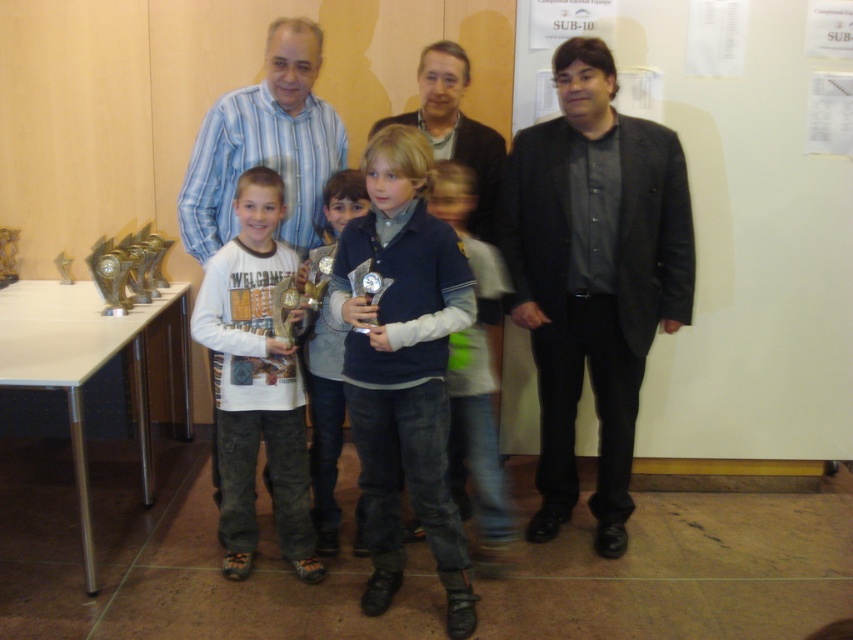
Question: Is dark blue denim jeans at center below denim jeans at center?

Choices:
 (A) yes
 (B) no

Answer: (A)

Question: Considering the real-world distances, which object is farthest from the blue denim jeans at center?

Choices:
 (A) matte black jacket at center
 (B) denim jeans at center

Answer: (A)

Question: Does dark gray textured blazer at right have a larger size compared to white cotton shirt at center?

Choices:
 (A) no
 (B) yes

Answer: (B)

Question: Does dark gray textured blazer at right appear on the left side of white cotton shirt at center?

Choices:
 (A) yes
 (B) no

Answer: (B)

Question: Estimate the real-world distances between objects in this image. Which object is farther from the denim jeans at center?

Choices:
 (A) matte black jacket at center
 (B) dark gray textured blazer at right
 (C) white cotton shirt at center

Answer: (A)

Question: Which object is positioned closest to the white cotton shirt at center?

Choices:
 (A) matte black jacket at center
 (B) dark blue denim jeans at center
 (C) denim jeans at center
 (D) dark gray textured blazer at right

Answer: (B)